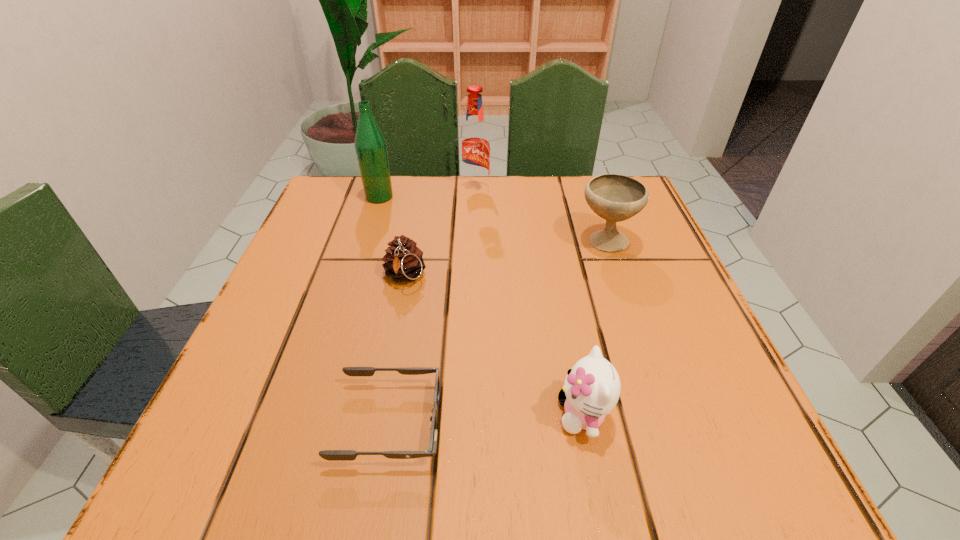
Where is `free space at the far right corner of the desktop`? Image resolution: width=960 pixels, height=540 pixels. free space at the far right corner of the desktop is located at coordinates (586, 232).

The image size is (960, 540). I want to click on blank region between the sunglasses and the root beer, so click(x=432, y=307).

Find the location of a particular element. Image resolution: width=960 pixels, height=540 pixels. free space between the sunglasses and the rightmost object is located at coordinates (497, 332).

In order to click on empty space between the pinecone and the bottle in this screenshot , I will do `click(392, 237)`.

I want to click on free space that is in between the root beer and the chalice, so click(540, 216).

The width and height of the screenshot is (960, 540). Find the location of `vacant space that's between the kitten and the shortest object`. vacant space that's between the kitten and the shortest object is located at coordinates (486, 418).

Locate an element on the screen. vacant area that lies between the bottle and the root beer is located at coordinates (427, 194).

This screenshot has height=540, width=960. What are the coordinates of `vacant region between the pinecone and the third farthest object` in the screenshot? It's located at (505, 259).

Identify the location of free space between the bottle and the shortest object. (384, 310).

Where is `free space between the shortest object and the bottle`? The image size is (960, 540). free space between the shortest object and the bottle is located at coordinates (384, 310).